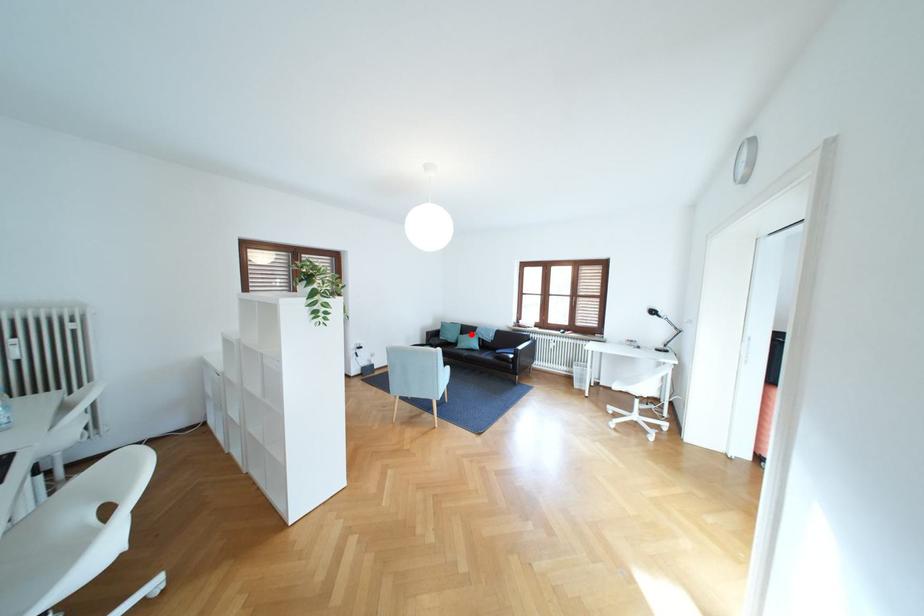
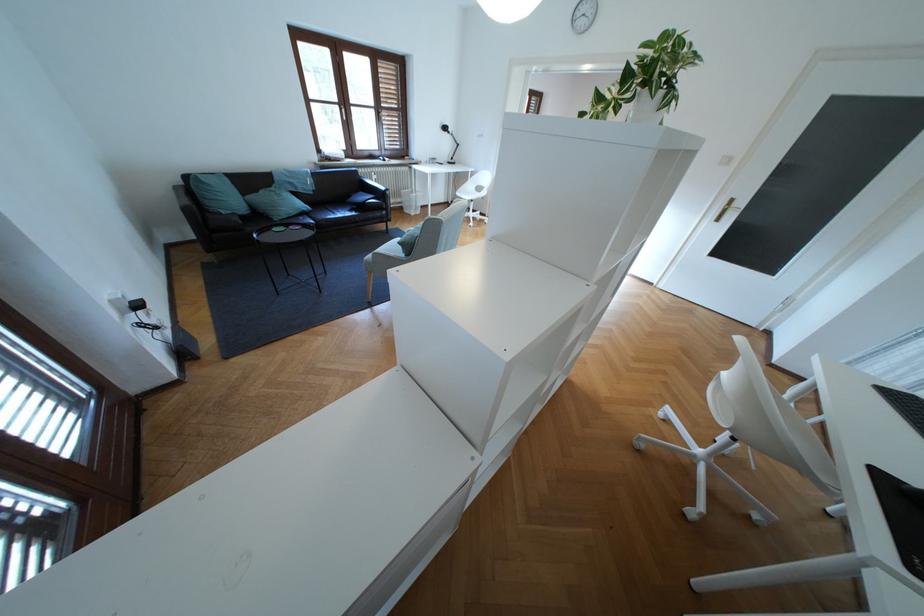
Question: I am providing you with two images of the same scene from different viewpoints. Image1 has a red point marked. In image2, the corresponding 3D location appears at what relative position? Reply with the corresponding letter.

Choices:
 (A) Closer
 (B) Farther

Answer: (A)